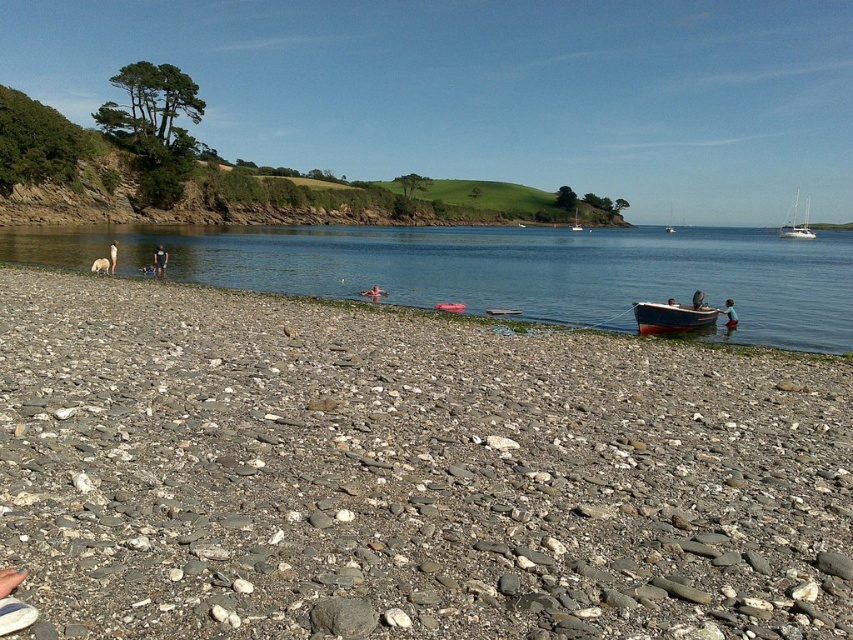
Question: Can you confirm if clear water at beach left is bigger than white glossy sailboat at upper right?

Choices:
 (A) no
 (B) yes

Answer: (B)

Question: Among these points, which one is nearest to the camera?

Choices:
 (A) (366, 276)
 (B) (793, 209)

Answer: (A)

Question: Which of the following is the closest to the observer?

Choices:
 (A) light brown skin at lower left
 (B) brown leather jacket at center

Answer: (B)

Question: Considering the relative positions of gray gravel beach at lower left and blue wooden boat at lower right in the image provided, where is gray gravel beach at lower left located with respect to blue wooden boat at lower right?

Choices:
 (A) right
 (B) left

Answer: (B)

Question: Which object is the farthest from the blue wooden boat at lower right?

Choices:
 (A) brown leather jacket at center
 (B) clear water at beach left
 (C) gray gravel beach at lower left

Answer: (B)

Question: In this image, where is clear water at beach left located relative to brown leather jacket at center?

Choices:
 (A) below
 (B) above

Answer: (B)